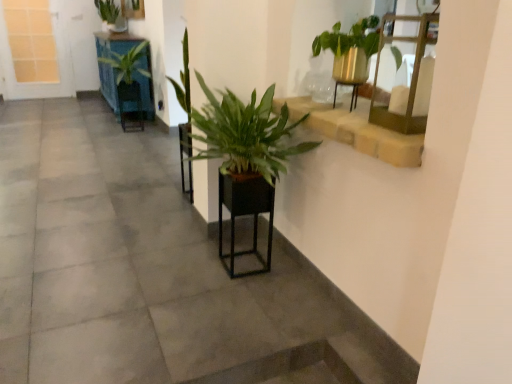
This screenshot has width=512, height=384. Identify the location of vacant point to the right of black matte planter at center, which ranks as the first armchair in right-to-left order. (284, 269).